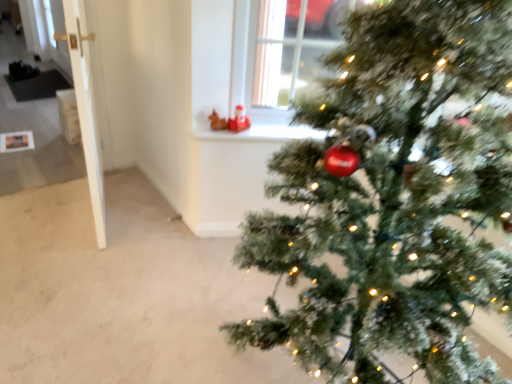
Question: Is white glossy window sill at upper center to the left of green frosted christmas tree at right from the viewer's perspective?

Choices:
 (A) yes
 (B) no

Answer: (A)

Question: Can green frosted christmas tree at right be found inside white glossy window sill at upper center?

Choices:
 (A) no
 (B) yes

Answer: (A)

Question: Can you confirm if white glossy window sill at upper center is wider than green frosted christmas tree at right?

Choices:
 (A) no
 (B) yes

Answer: (A)

Question: From a real-world perspective, is white glossy window sill at upper center located higher than green frosted christmas tree at right?

Choices:
 (A) yes
 (B) no

Answer: (B)

Question: Considering the relative sizes of white glossy window sill at upper center and green frosted christmas tree at right in the image provided, is white glossy window sill at upper center bigger than green frosted christmas tree at right?

Choices:
 (A) no
 (B) yes

Answer: (A)

Question: Does white glossy window sill at upper center have a greater height compared to green frosted christmas tree at right?

Choices:
 (A) no
 (B) yes

Answer: (A)

Question: From a real-world perspective, is green frosted christmas tree at right positioned under white glossy window sill at upper center based on gravity?

Choices:
 (A) yes
 (B) no

Answer: (B)

Question: Can you see green frosted christmas tree at right touching white glossy window sill at upper center?

Choices:
 (A) no
 (B) yes

Answer: (A)

Question: From a real-world perspective, is green frosted christmas tree at right on white glossy window sill at upper center?

Choices:
 (A) yes
 (B) no

Answer: (A)

Question: Does green frosted christmas tree at right appear on the left side of white glossy window sill at upper center?

Choices:
 (A) no
 (B) yes

Answer: (A)

Question: Is green frosted christmas tree at right not near white glossy window sill at upper center?

Choices:
 (A) yes
 (B) no

Answer: (B)

Question: From the image's perspective, is green frosted christmas tree at right above white glossy window sill at upper center?

Choices:
 (A) yes
 (B) no

Answer: (B)

Question: In terms of width, does green frosted christmas tree at right look wider or thinner when compared to white glossy window sill at upper center?

Choices:
 (A) wide
 (B) thin

Answer: (A)